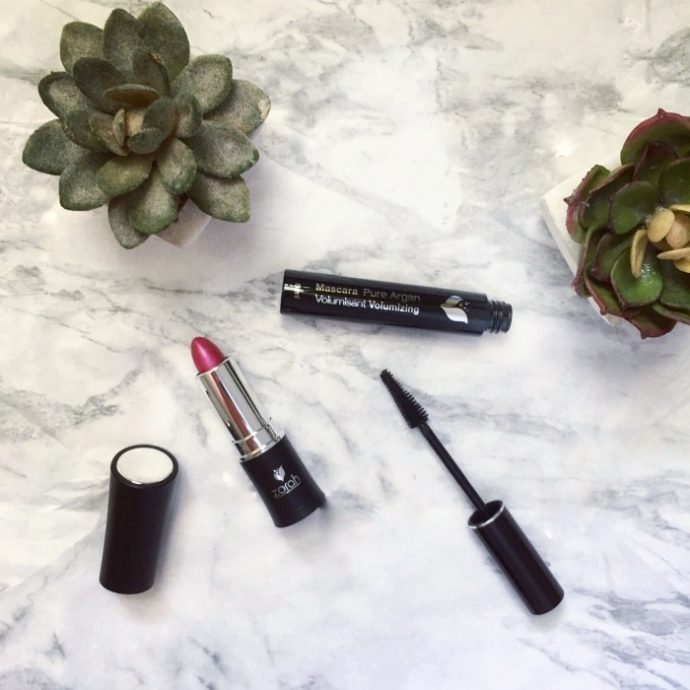
I want to click on yellow part of fake plant, so click(664, 236).